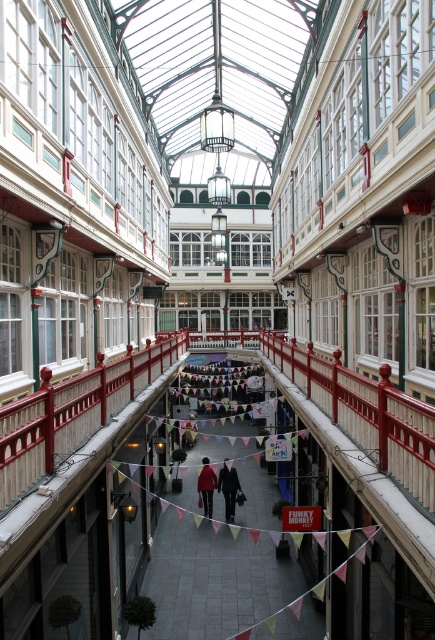
Consider the image. Is wooden railing at center positioned at the back of matte red coat at center?

No, wooden railing at center is closer to the viewer.

In the scene shown: Can you confirm if wooden railing at center is taller than matte red coat at center?

No.

Which is in front, point (70, 445) or point (210, 497)?

Point (70, 445) is more forward.

Find the location of a particular element. The image size is (435, 640). wooden railing at center is located at coordinates (73, 413).

You are a GUI agent. You are given a task and a screenshot of the screen. Output one action in this format:
    pyautogui.click(x=<x>, y=<y>)
    Task: Click on the red painted metal railing at center
    
    Given the screenshot: What is the action you would take?
    pyautogui.click(x=365, y=413)

Does point (307, 387) lie in front of point (237, 488)?

Yes, it is in front of point (237, 488).

Does point (360, 413) come in front of point (228, 483)?

Yes, it is.

Locate an element on the screen. red painted metal railing at center is located at coordinates (365, 413).

In the scene shown: Is wooden railing at center shorter than dark gray fabric coat at center?

Incorrect, wooden railing at center's height does not fall short of dark gray fabric coat at center's.

Does wooden railing at center have a greater width compared to dark gray fabric coat at center?

Yes.

Is point (97, 380) behind point (233, 513)?

No, (97, 380) is closer to viewer.

Locate an element on the screen. wooden railing at center is located at coordinates (73, 413).